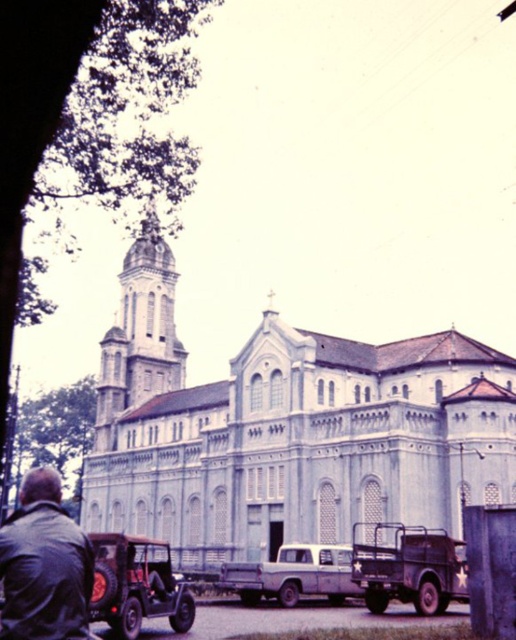
Question: Estimate the real-world distances between objects in this image. Which object is farther from the matte gray truck at center?

Choices:
 (A) light gray stone church at center
 (B) rustic brown jeep at lower left

Answer: (A)

Question: Which object appears farthest from the camera in this image?

Choices:
 (A) light gray stone church at center
 (B) matte gray truck at center

Answer: (A)

Question: Is rustic brown jeep at lower left above matte gray truck at center?

Choices:
 (A) no
 (B) yes

Answer: (B)

Question: Which is nearer to the matte gray truck at center?

Choices:
 (A) matte green truck at center
 (B) light gray stone church at center
 (C) rustic brown jeep at lower left

Answer: (A)

Question: Does light gray stone church at center appear on the right side of matte gray truck at center?

Choices:
 (A) no
 (B) yes

Answer: (A)

Question: Can you confirm if light gray stone church at center is smaller than rustic brown jeep at lower left?

Choices:
 (A) yes
 (B) no

Answer: (B)